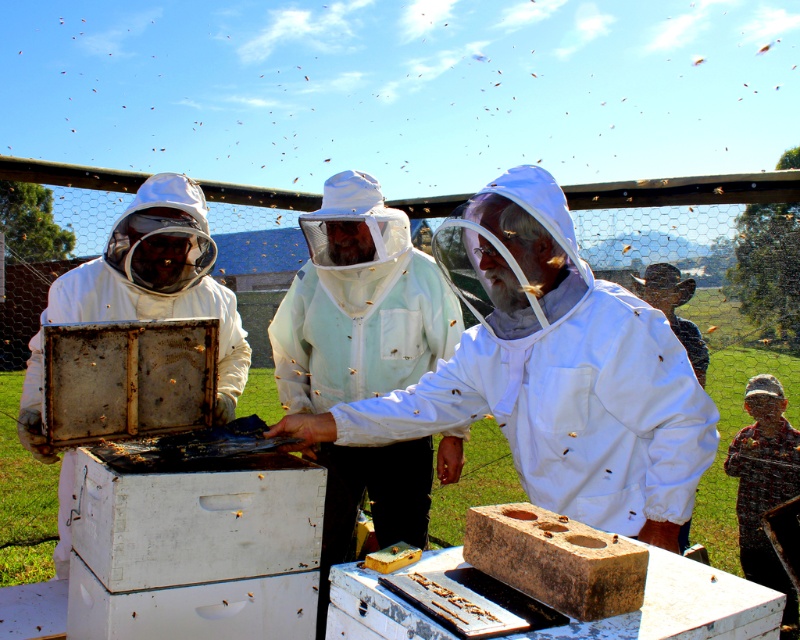
You are a drone operator tasked with capturing aerial footage of the beekeepers. The drone must maintain a safe distance of at least 2 meters from any person. Given that the white fabric beekeeper at center is located at point (x=552, y=372), can you confirm if the drone can safely hover directly above this point without violating the safety distance requirement?

The white fabric beekeeper at center is located at point (x=552, y=372). Since the drone needs to maintain a minimum distance of 2 meters from any person, hovering directly above this point would place the drone directly over the beekeeper, which is unsafe. Therefore, the drone cannot safely hover there.

You are a beekeeper planning to move from your current position to the beehive on the far right. There are two other beekeepers in the way. The white fabric beekeeper at center and the white matte beekeeper suit at left are blocking your path. Can you walk between them to reach the hive?

The white fabric beekeeper at center and the white matte beekeeper suit at left are 32.75 inches apart. Since the gap between them is about 32.75 inches, which is roughly 2.73 feet, it would be tight but possible for a person to squeeze through, provided they move carefully. However, considering safety and the need to avoid disturbing the bees, it might be better to wait for one of them to move out of the way first.

You are a visitor at the bee farm and want to take a photo of the white fabric beekeeper at center and the brown textured block at center. Which object should you focus on first if you want to capture both in one frame without moving the camera?

The white fabric beekeeper at center has a larger size compared to the brown textured block at center, so you should focus on the white fabric beekeeper at center first to ensure it fits properly in the frame before adjusting for the smaller brown textured block at center.